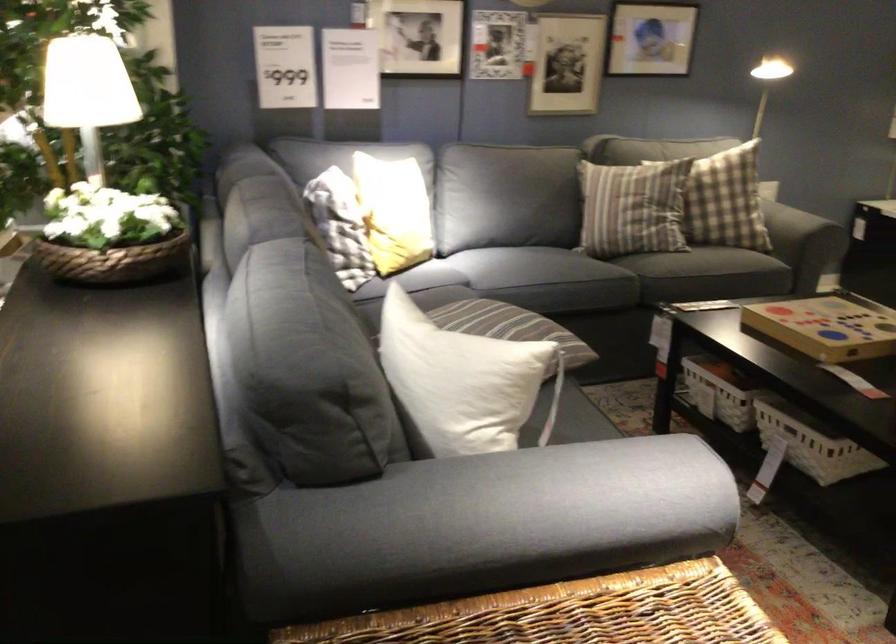
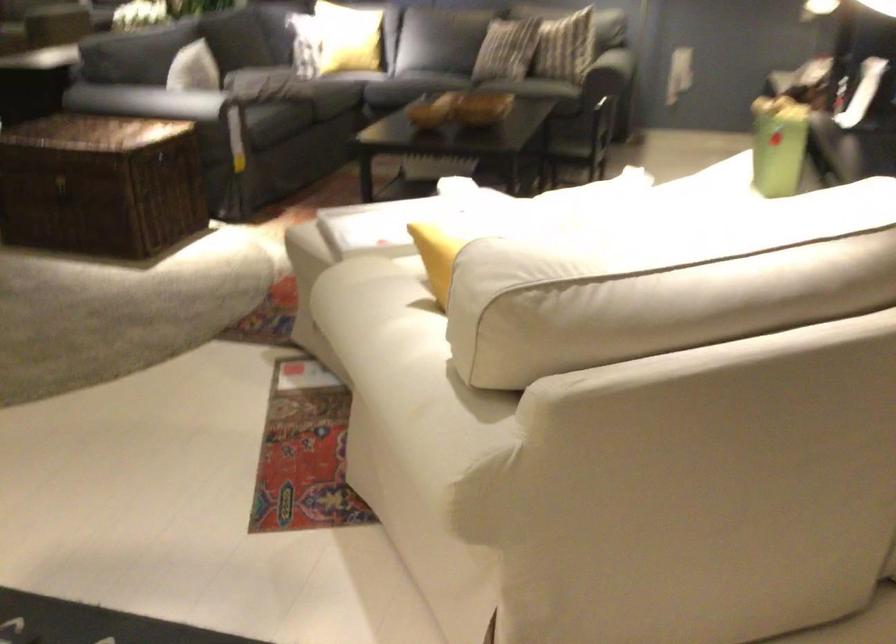
In a continuous first-person perspective shot, in which direction is the camera moving?

The cameraman walked toward right, backward.